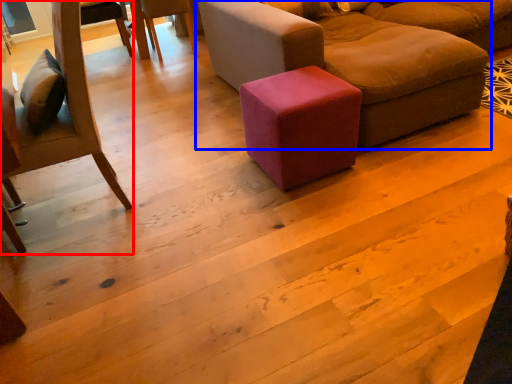
Question: Which object appears closest to the camera in this image, chair (highlighted by a red box) or studio couch (highlighted by a blue box)?

Choices:
 (A) chair
 (B) studio couch

Answer: (A)